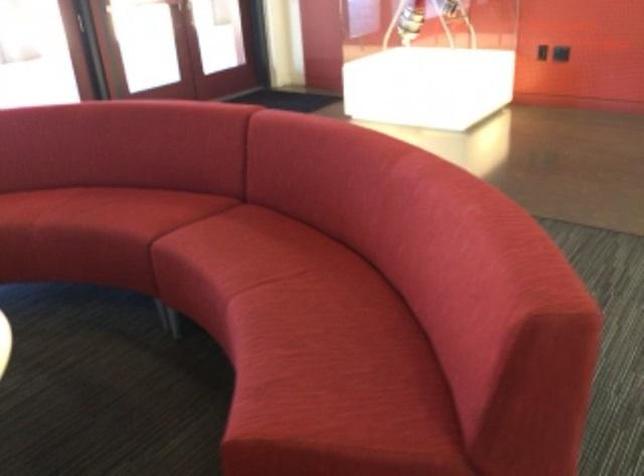
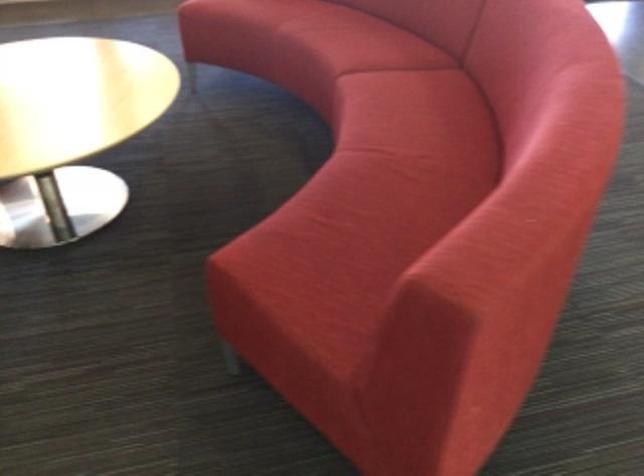
Find the pixel in the second image that matches pixel 290 258 in the first image.

(422, 135)